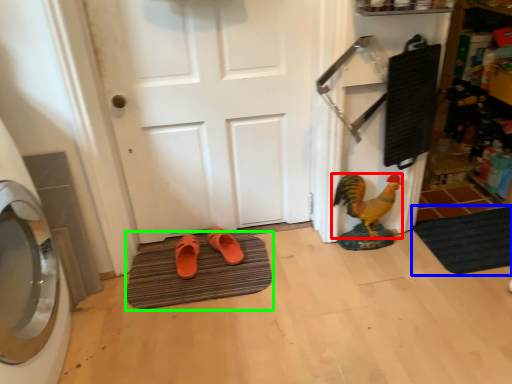
Question: Which object is positioned closest to chicken (highlighted by a red box)? Select from bath mat (highlighted by a blue box) and bath mat (highlighted by a green box).

Choices:
 (A) bath mat
 (B) bath mat

Answer: (A)